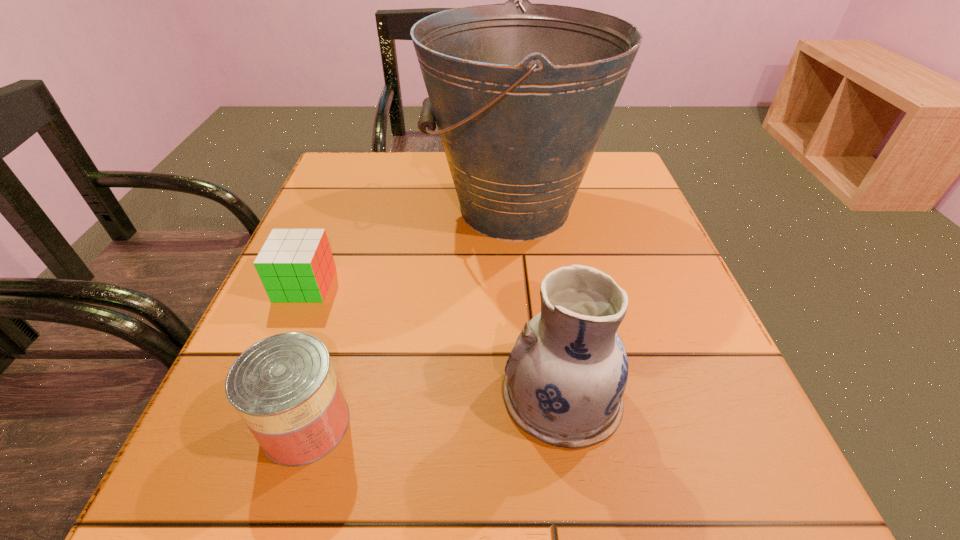
Find the location of a particular element. This screenshot has width=960, height=540. vacant area between the tallest object and the can is located at coordinates (410, 316).

Locate an element on the screen. vacant point located between the tallest object and the pottery is located at coordinates (538, 302).

The height and width of the screenshot is (540, 960). In order to click on blank region between the shortest object and the third shortest object in this screenshot , I will do `click(433, 340)`.

At what (x,y) coordinates should I click in order to perform the action: click on the second closest object to the third nearest object. Please return your answer as a coordinate pair (x, y). This screenshot has height=540, width=960. Looking at the image, I should click on (284, 387).

Identify which object is located as the second nearest to the pottery. Please provide its 2D coordinates. Your answer should be formatted as a tuple, i.e. [(x, y)], where the tuple contains the x and y coordinates of a point satisfying the conditions above.

[(284, 387)]

Find the location of a particular element. This screenshot has height=540, width=960. free space that satisfies the following two spatial constraints: 1. with the handle on opposite sides of the tallest object; 2. on the front side of the second shortest object is located at coordinates tap(536, 424).

What are the coordinates of `free point that satisfies the following two spatial constraints: 1. with the handle on opposite sides of the third shortest object; 2. on the left side of the tallest object` in the screenshot? It's located at (533, 395).

Where is `free space that satisfies the following two spatial constraints: 1. with the handle on opposite sides of the tallest object; 2. on the left side of the pottery`? The image size is (960, 540). free space that satisfies the following two spatial constraints: 1. with the handle on opposite sides of the tallest object; 2. on the left side of the pottery is located at coordinates (533, 395).

Where is `free space in the image that satisfies the following two spatial constraints: 1. on the back side of the pottery; 2. on the left side of the can`? This screenshot has width=960, height=540. free space in the image that satisfies the following two spatial constraints: 1. on the back side of the pottery; 2. on the left side of the can is located at coordinates [x=315, y=395].

Find the location of `free space that satisfies the following two spatial constraints: 1. on the front side of the pottery; 2. on the left side of the second farthest object`. free space that satisfies the following two spatial constraints: 1. on the front side of the pottery; 2. on the left side of the second farthest object is located at coordinates (258, 395).